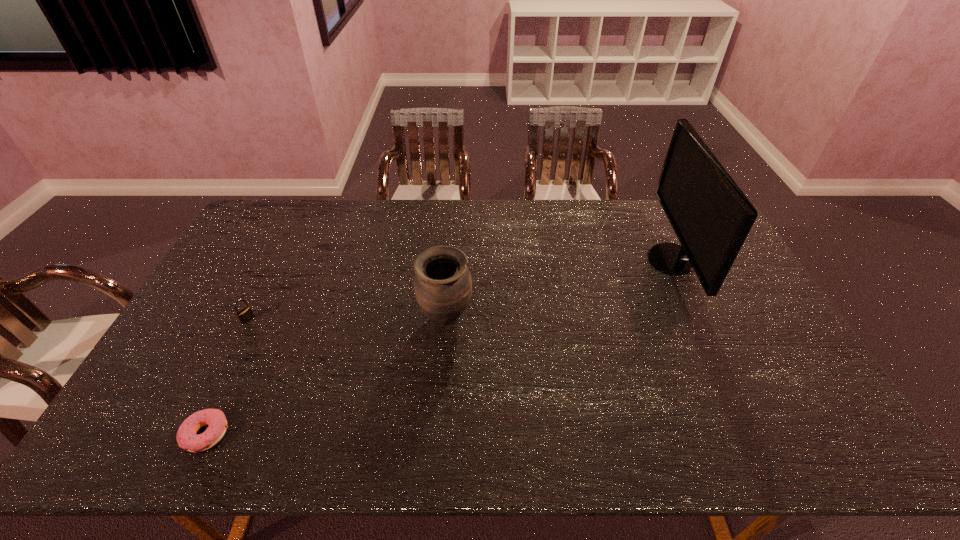
Identify the location of free space that is in between the urn and the doughnut. The height and width of the screenshot is (540, 960). (325, 376).

Where is `unoccupied area between the second shortest object and the nearest object`? This screenshot has width=960, height=540. unoccupied area between the second shortest object and the nearest object is located at coordinates (227, 377).

At what (x,y) coordinates should I click in order to perform the action: click on free spot between the third object from left to right and the doughnut. Please return your answer as a coordinate pair (x, y). Looking at the image, I should click on (325, 376).

Locate an element on the screen. object that is the closest to the second shortest object is located at coordinates (187, 438).

Locate an element on the screen. The height and width of the screenshot is (540, 960). object that is the second closest one to the second shortest object is located at coordinates (443, 286).

Image resolution: width=960 pixels, height=540 pixels. What are the coordinates of `vacant space that satisfies the following two spatial constraints: 1. on the front-facing side of the tallest object; 2. on the front side of the shortest object` in the screenshot? It's located at (754, 434).